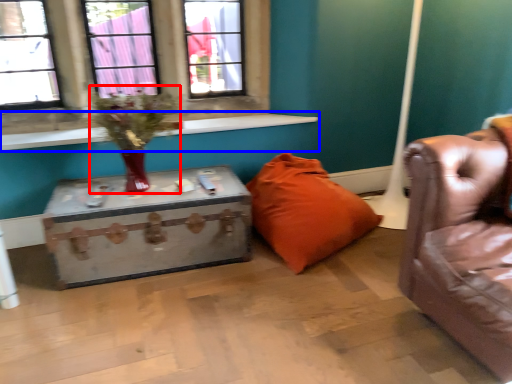
Question: Which point is closer to the camera, floral arrangement (highlighted by a red box) or window sill (highlighted by a blue box)?

Choices:
 (A) floral arrangement
 (B) window sill

Answer: (A)